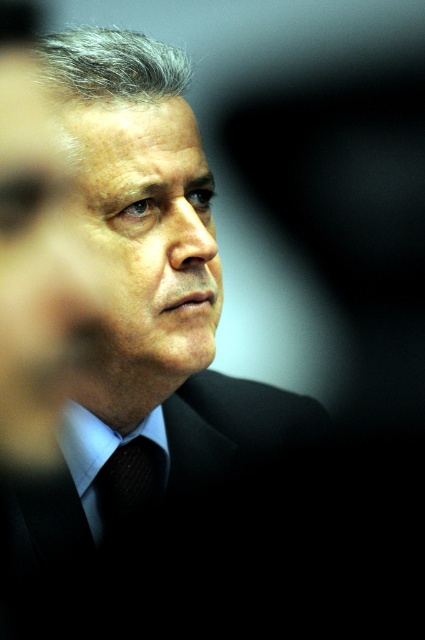
You are a photographer adjusting your camera settings to capture a detailed closeup of the black textured tie at center. The camera lens is currently positioned 26.02 inches away from the tie. If you want to ensure the tie fills the frame without cropping any part of it, what adjustment should you make to the camera lens?

The camera lens is currently 26.02 inches away from the black textured tie at center. To ensure the tie fills the frame without cropping, you should adjust the lens to a wider angle or move the camera closer to the tie.

You are a tailor measuring a client for a custom suit. The client is wearing a black silk suit at center and a light blue fabric dress shirt at center. Which garment has a wider width measurement?

The black silk suit at center has a larger width than the light blue fabric dress shirt at center according to the description.